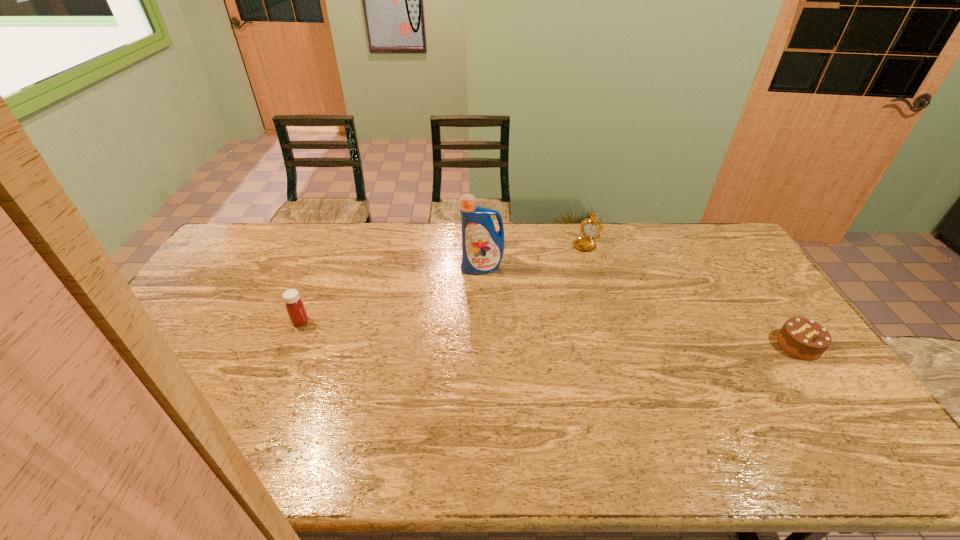
You are a GUI agent. You are given a task and a screenshot of the screen. Output one action in this format:
    pyautogui.click(x=<x>, y=<y>)
    Task: Click on the vacant space on the desktop that is between the leftmost object and the rightmost object and is positioned on the face of the second object from right to left
    The width and height of the screenshot is (960, 540).
    Given the screenshot: What is the action you would take?
    pyautogui.click(x=531, y=332)

Image resolution: width=960 pixels, height=540 pixels. Identify the location of vacant spot on the desktop that is between the medicine and the chocolate cake and is positioned on the label of the third object from right to left. (475, 329).